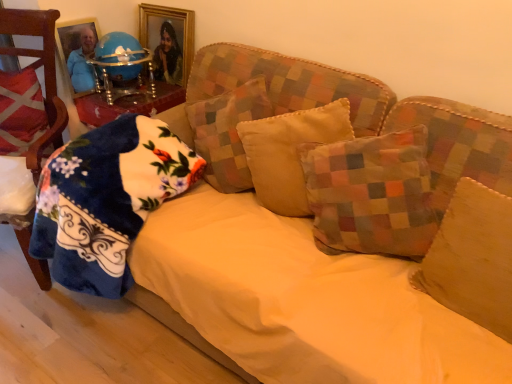
Where is `vacant area on top of gold-framed picture at upper center (from a real-world perspective)`? vacant area on top of gold-framed picture at upper center (from a real-world perspective) is located at coordinates (159, 3).